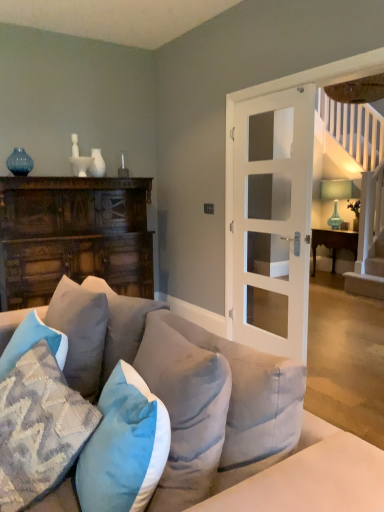
Question: Is dark wood cabinet at left at the back of white glass door at center?

Choices:
 (A) yes
 (B) no

Answer: (B)

Question: Is white glass door at center to the right of dark wood cabinet at left from the viewer's perspective?

Choices:
 (A) yes
 (B) no

Answer: (A)

Question: Can you confirm if white glass door at center is smaller than dark wood cabinet at left?

Choices:
 (A) yes
 (B) no

Answer: (A)

Question: Is white glass door at center to the left of dark wood cabinet at left from the viewer's perspective?

Choices:
 (A) no
 (B) yes

Answer: (A)

Question: Would you say white glass door at center is a long distance from dark wood cabinet at left?

Choices:
 (A) yes
 (B) no

Answer: (A)

Question: From the image's perspective, relative to wooden table at right, is green glass vase at right above or below?

Choices:
 (A) above
 (B) below

Answer: (A)

Question: Looking at the image, does green glass vase at right seem bigger or smaller compared to wooden table at right?

Choices:
 (A) small
 (B) big

Answer: (A)

Question: Considering the positions of point (337, 215) and point (354, 241), is point (337, 215) closer or farther from the camera than point (354, 241)?

Choices:
 (A) farther
 (B) closer

Answer: (A)

Question: From a real-world perspective, is green glass vase at right above or below wooden table at right?

Choices:
 (A) below
 (B) above

Answer: (B)

Question: In terms of width, does dark wood cabinet at left look wider or thinner when compared to green glass vase at right?

Choices:
 (A) thin
 (B) wide

Answer: (B)

Question: From the image's perspective, relative to green glass vase at right, is dark wood cabinet at left above or below?

Choices:
 (A) below
 (B) above

Answer: (A)

Question: Is dark wood cabinet at left spatially inside green glass vase at right, or outside of it?

Choices:
 (A) inside
 (B) outside

Answer: (B)

Question: Is dark wood cabinet at left taller or shorter than green glass vase at right?

Choices:
 (A) short
 (B) tall

Answer: (B)

Question: Considering the positions of dark wood cabinet at left and white glass door at center in the image, is dark wood cabinet at left taller or shorter than white glass door at center?

Choices:
 (A) tall
 (B) short

Answer: (B)

Question: Considering the positions of dark wood cabinet at left and white glass door at center in the image, is dark wood cabinet at left bigger or smaller than white glass door at center?

Choices:
 (A) small
 (B) big

Answer: (B)